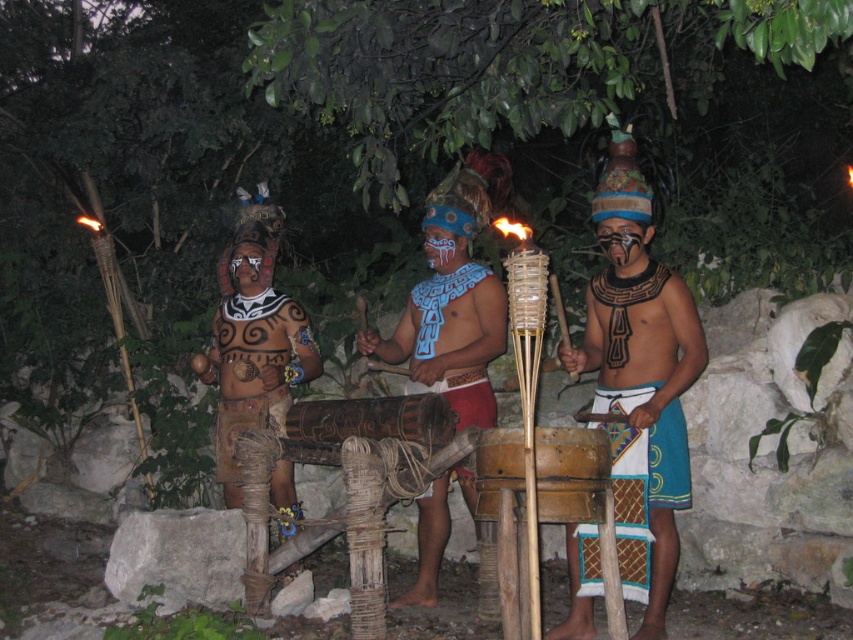
Between point (277, 333) and point (483, 502), which one is positioned in front?

Positioned in front is point (483, 502).

Which is in front, point (245, 410) or point (508, 467)?

Point (508, 467)

This screenshot has width=853, height=640. In order to click on matte brown wood drum at center in this screenshot , I will do `click(258, 324)`.

In the scene shown: Is matte black face paint at center smaller than matte black face at center?

Correct, matte black face paint at center occupies less space than matte black face at center.

Is point (637, 244) positioned before point (251, 259)?

Yes.

Does point (605, 225) come in front of point (265, 264)?

Yes, it is.

At what (x,y) coordinates should I click in order to perform the action: click on matte black face paint at center. Please return your answer as a coordinate pair (x, y). The image size is (853, 640). Looking at the image, I should click on (622, 241).

Is the position of matte blue fabric at center more distant than that of matte brown wood drum at center?

That is False.

This screenshot has width=853, height=640. Identify the location of matte blue fabric at center. (643, 417).

Does point (654, 304) lie in front of point (309, 330)?

Yes, it is.

Identify the location of matte blue fabric at center. (643, 417).